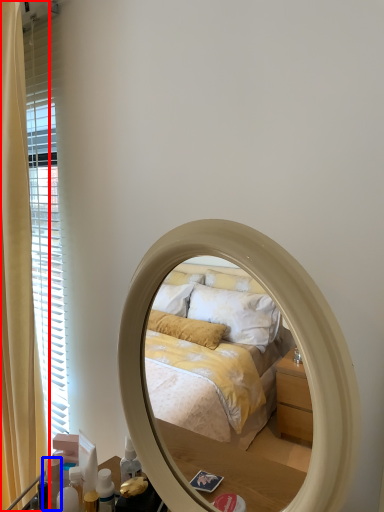
Question: Which of the following is the farthest to the observer, curtain (highlighted by a red box) or toiletry (highlighted by a blue box)?

Choices:
 (A) curtain
 (B) toiletry

Answer: (B)